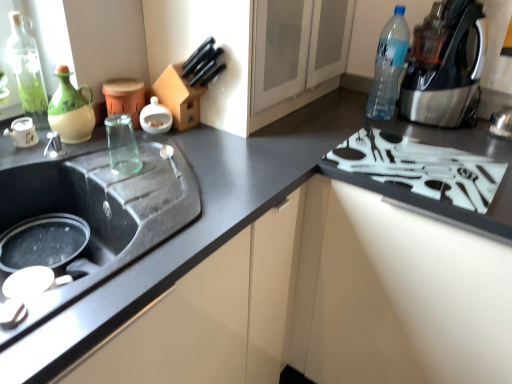
I want to click on free space to the left of blue plastic bottle at upper right, the 1th bottle in the right-to-left sequence, so click(335, 115).